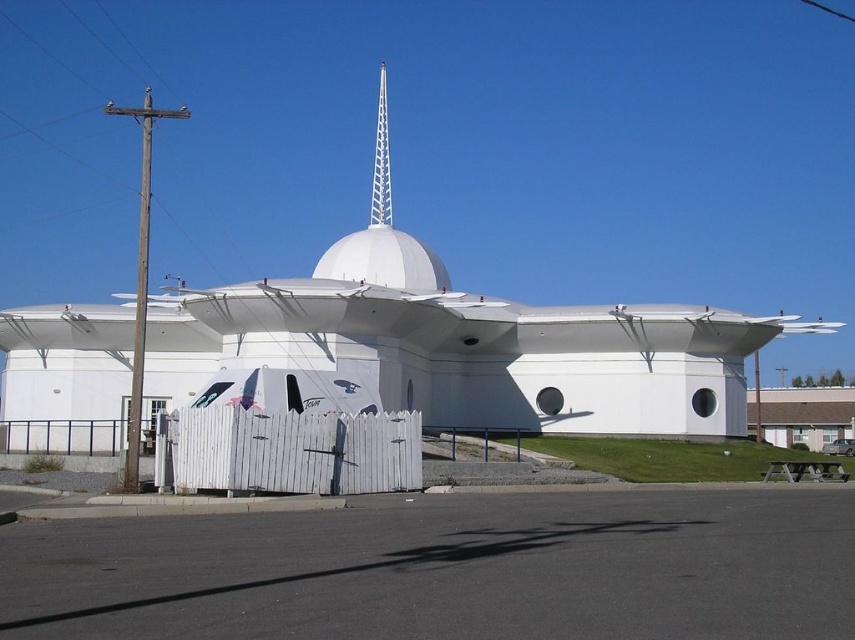
You are standing at the entrance of the modern white building and want to place a new decorative banner on the white picket fence at lower center. According to the coordinates provided, what are the exact coordinates where you should place the banner?

The white picket fence at lower center is located at coordinates point (293,451), so you should place the banner there.

You are standing at the entrance of the modern white building and see two points marked in the scene. The first point is at coordinates point [221,460] and the second point is at point [381,77]. Which point is closer to you?

Point [221,460] is in front of point [381,77], so it is closer to you.

You are standing in front of the modern white building and want to take a photo that includes both the white picket fence at lower center and the white lattice spire at center. Which object should you position closer to the front of your camera frame to ensure both are visible?

You should position the white picket fence at lower center closer to the front of your camera frame because it is closer to the viewer than the white lattice spire at center, ensuring both are visible in the photo.